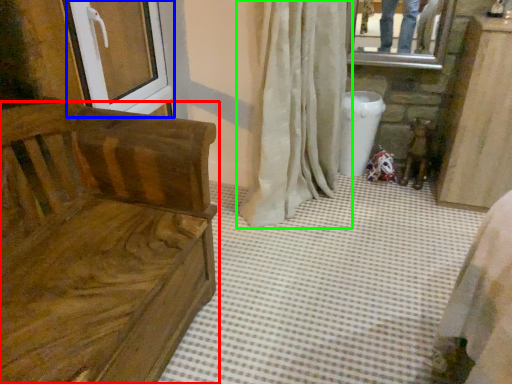
Question: Estimate the real-world distances between objects in this image. Which object is closer to furniture (highlighted by a red box), screen door (highlighted by a blue box) or curtain (highlighted by a green box)?

Choices:
 (A) screen door
 (B) curtain

Answer: (A)